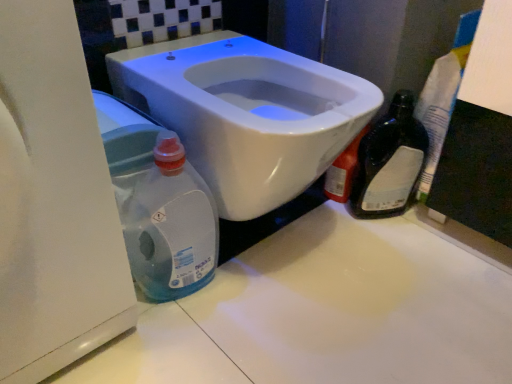
Image resolution: width=512 pixels, height=384 pixels. In order to click on blank space above white glossy counter top at center (from a real-world perspective) in this screenshot , I will do `click(313, 291)`.